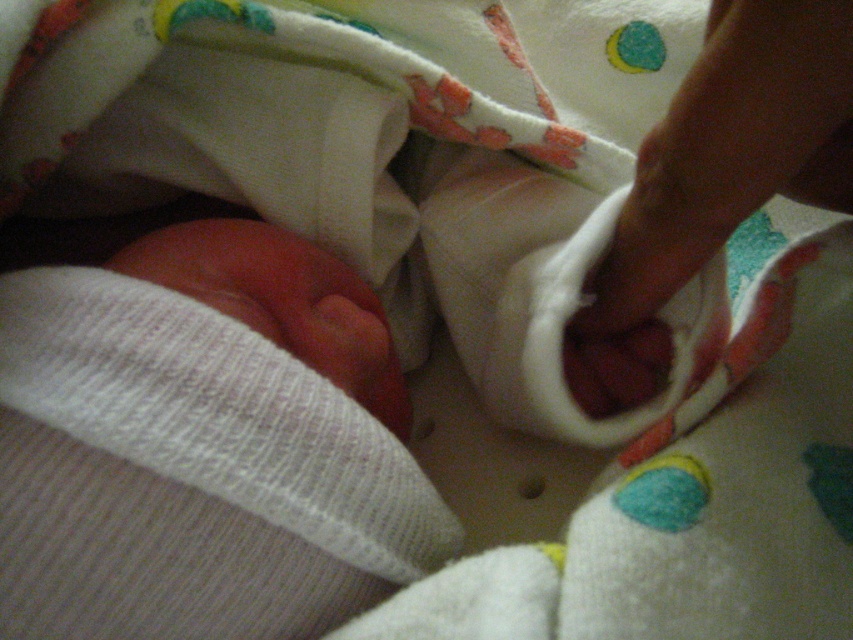
You are trying to find your hand in the image of a fabric container. Where is the smooth skin hand at center located in terms of coordinates?

The smooth skin hand at center is located at point (730,150).

You are a person trying to reach into the fabric container to retrieve an item. You notice there are two parts of your hand visible inside the container. Which part of your hand is narrower between the smooth skin hand at center and the pink soft skin at center?

The smooth skin hand at center is thinner than the pink soft skin at center, so the smooth skin hand at center is narrower.